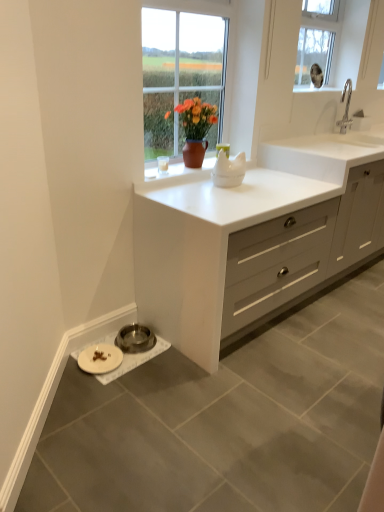
Question: From the image's perspective, is white matte cabinet at center located above white ceramic sink at upper right?

Choices:
 (A) yes
 (B) no

Answer: (B)

Question: Is the depth of white matte cabinet at center greater than that of white ceramic sink at upper right?

Choices:
 (A) no
 (B) yes

Answer: (A)

Question: Does white matte cabinet at center have a greater width compared to white ceramic sink at upper right?

Choices:
 (A) no
 (B) yes

Answer: (B)

Question: Can you confirm if white matte cabinet at center is taller than white ceramic sink at upper right?

Choices:
 (A) yes
 (B) no

Answer: (A)

Question: Is white matte cabinet at center surrounding white ceramic sink at upper right?

Choices:
 (A) no
 (B) yes

Answer: (A)

Question: From the image's perspective, is white matte plate at lower left above or below clear glass window at upper center?

Choices:
 (A) below
 (B) above

Answer: (A)

Question: Considering the positions of white matte plate at lower left and clear glass window at upper center in the image, is white matte plate at lower left bigger or smaller than clear glass window at upper center?

Choices:
 (A) big
 (B) small

Answer: (B)

Question: From a real-world perspective, relative to clear glass window at upper center, is white matte plate at lower left vertically above or below?

Choices:
 (A) below
 (B) above

Answer: (A)

Question: Relative to clear glass window at upper center, is white matte plate at lower left in front or behind?

Choices:
 (A) behind
 (B) front

Answer: (B)

Question: In the image, is white matte plate at lower left on the left side or the right side of white ceramic sink at upper right?

Choices:
 (A) left
 (B) right

Answer: (A)

Question: Is white matte plate at lower left spatially inside white ceramic sink at upper right, or outside of it?

Choices:
 (A) inside
 (B) outside

Answer: (B)

Question: From the image's perspective, relative to white ceramic sink at upper right, is white matte plate at lower left above or below?

Choices:
 (A) above
 (B) below

Answer: (B)

Question: Considering the positions of white matte plate at lower left and white ceramic sink at upper right in the image, is white matte plate at lower left wider or thinner than white ceramic sink at upper right?

Choices:
 (A) thin
 (B) wide

Answer: (A)

Question: Does point (213, 271) appear closer or farther from the camera than point (102, 364)?

Choices:
 (A) farther
 (B) closer

Answer: (B)

Question: Considering their positions, is white matte cabinet at center located in front of or behind white matte plate at lower left?

Choices:
 (A) front
 (B) behind

Answer: (A)